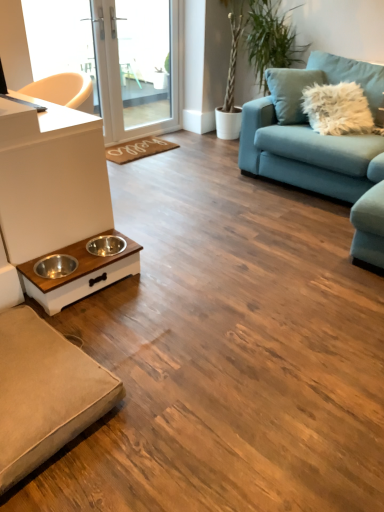
Question: Is white matte counter top at left wider or thinner than teal fabric couch at upper right, which appears as the 2th studio couch when viewed from the left?

Choices:
 (A) wide
 (B) thin

Answer: (B)

Question: Considering the relative positions of white matte counter top at left and teal fabric couch at upper right, the first studio couch from the back, in the image provided, is white matte counter top at left to the left or to the right of teal fabric couch at upper right, the first studio couch from the back,?

Choices:
 (A) left
 (B) right

Answer: (A)

Question: Based on their relative distances, which object is nearer to the white wood pet feeder at lower left?

Choices:
 (A) green leafy plant at upper right
 (B) white glossy screen door at upper center
 (C) brown woven mat at center
 (D) white matte counter top at left
 (E) beige fabric studio couch at lower left, marked as the first studio couch in a left-to-right arrangement

Answer: (D)

Question: Estimate the real-world distances between objects in this image. Which object is closer to the white glossy screen door at upper center?

Choices:
 (A) white wood pet feeder at lower left
 (B) white matte counter top at left
 (C) teal fabric couch at upper right, which ranks as the 1th studio couch in right-to-left order
 (D) beige fabric studio couch at lower left, the 2th studio couch positioned from the top
 (E) green leafy plant at upper right

Answer: (E)